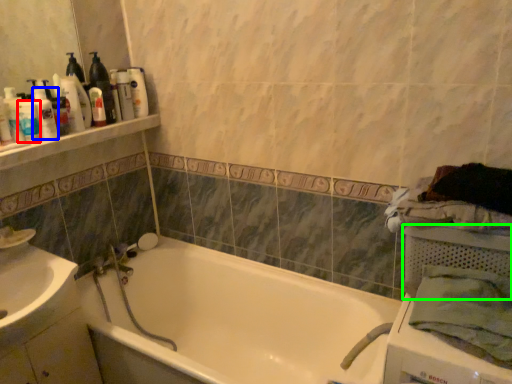
Question: Estimate the real-world distances between objects in this image. Which object is closer to toiletry (highlighted by a red box), toiletry (highlighted by a blue box) or basket (highlighted by a green box)?

Choices:
 (A) toiletry
 (B) basket

Answer: (A)